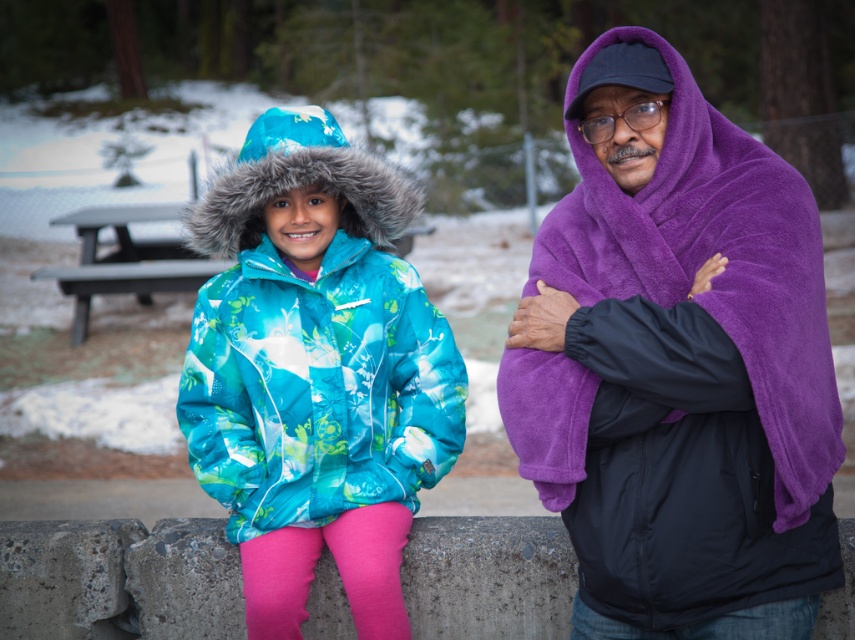
You are planning to set up a small tent between the purple fleece blanket at right and the gray wooden picnic table at center. Which object should the tent be closer to if the tent needs to be placed closer to the taller object?

The purple fleece blanket at right is taller than the gray wooden picnic table at center, so the tent should be closer to the purple fleece blanket at right.